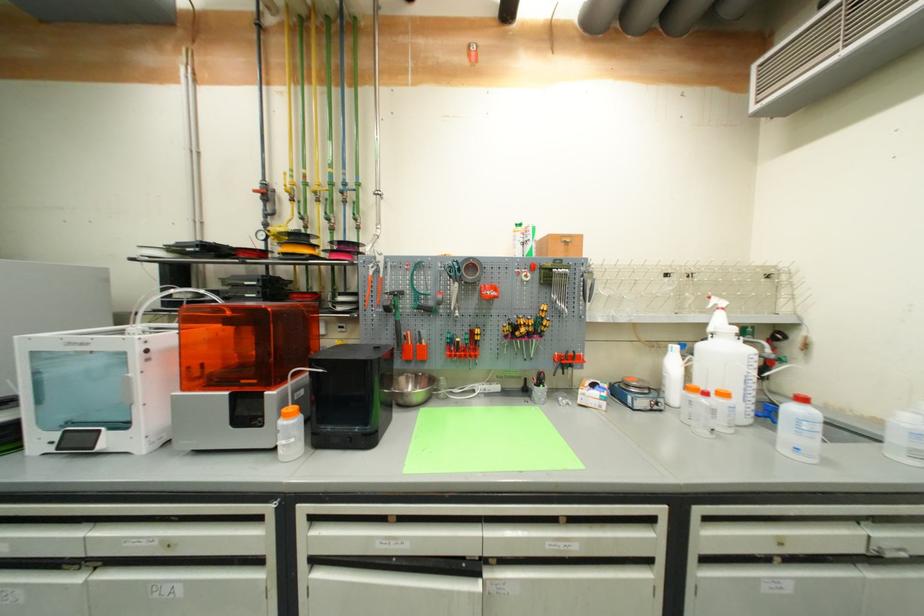
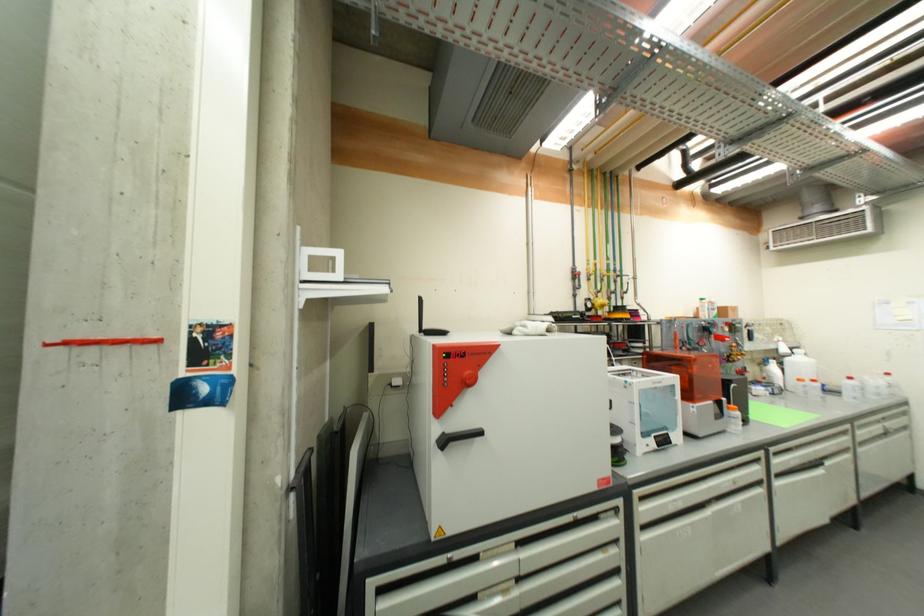
Where in the second image is the point corresponding to point (294, 418) from the first image?

(739, 411)